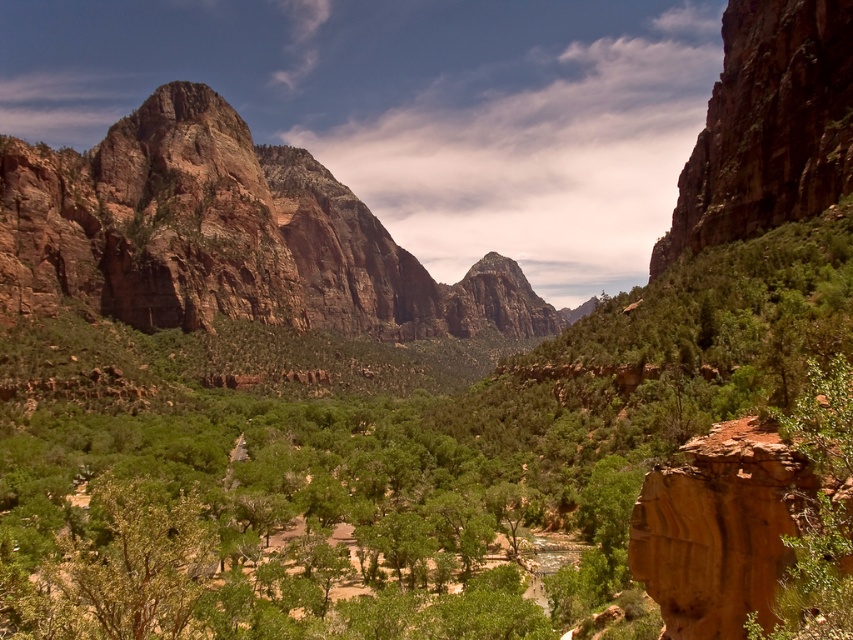
Which is behind, point (221, 220) or point (798, 413)?

The point (221, 220) is behind.

Which is more to the right, rustic rock formation at upper left or green leafy tree at right?

From the viewer's perspective, green leafy tree at right appears more on the right side.

Does point (230, 147) come behind point (805, 436)?

Yes, point (230, 147) is farther from viewer.

The image size is (853, 640). Find the location of `rustic rock formation at upper left`. rustic rock formation at upper left is located at coordinates (225, 236).